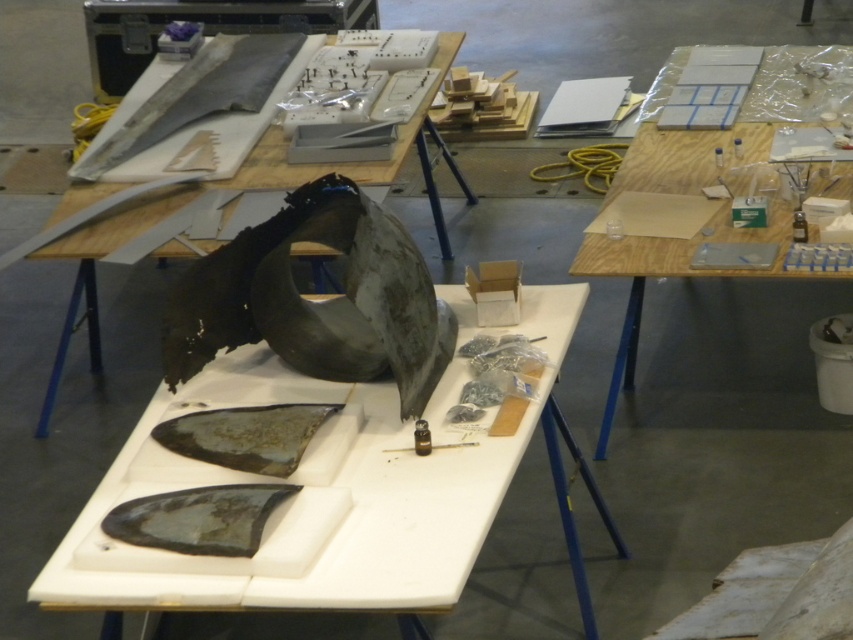
Question: Which point is closer to the camera?

Choices:
 (A) rusty metallic fish at center
 (B) shiny metallic fish at lower left

Answer: (B)

Question: Is matte gray metal at center smaller than matte black curved piece at center?

Choices:
 (A) no
 (B) yes

Answer: (B)

Question: Does wooden table at center lie behind matte black curved piece at center?

Choices:
 (A) no
 (B) yes

Answer: (A)

Question: Considering the real-world distances, which object is farthest from the matte black curved piece at center?

Choices:
 (A) shiny metallic fish at lower left
 (B) rusty metallic fish at center

Answer: (A)

Question: Can you confirm if wooden table at center is wider than shiny metallic fish at lower left?

Choices:
 (A) yes
 (B) no

Answer: (A)

Question: Which object is positioned farthest from the matte black curved piece at center?

Choices:
 (A) rusty metallic fish at center
 (B) matte gray metal at center
 (C) shiny metallic fish at lower left

Answer: (C)